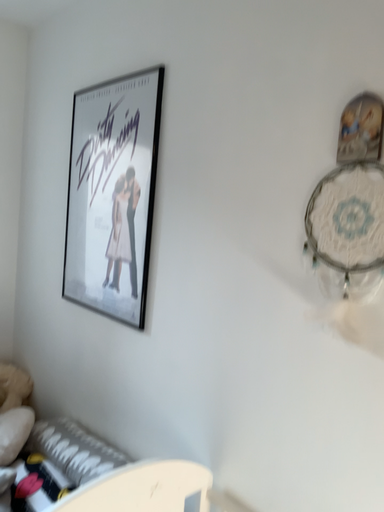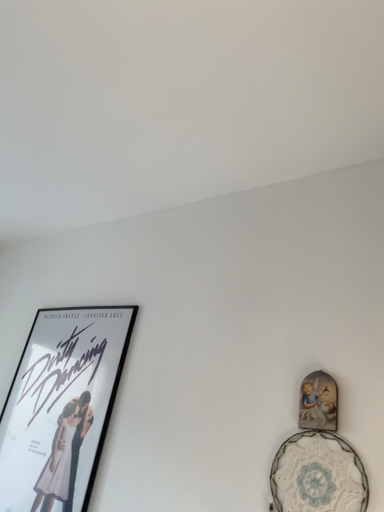
Question: Which way did the camera rotate in the video?

Choices:
 (A) rotated upward
 (B) rotated downward

Answer: (A)